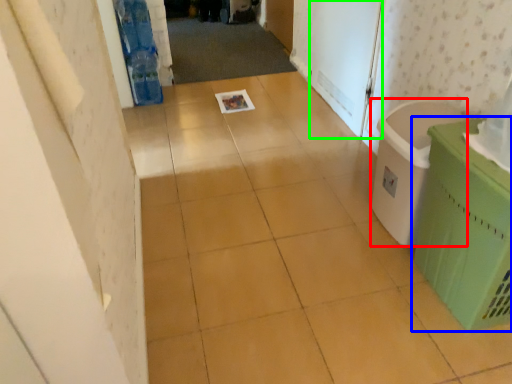
Question: Considering the real-world distances, which object is closest to laundry basket (highlighted by a red box)? waste container (highlighted by a blue box) or screen door (highlighted by a green box).

Choices:
 (A) waste container
 (B) screen door

Answer: (A)